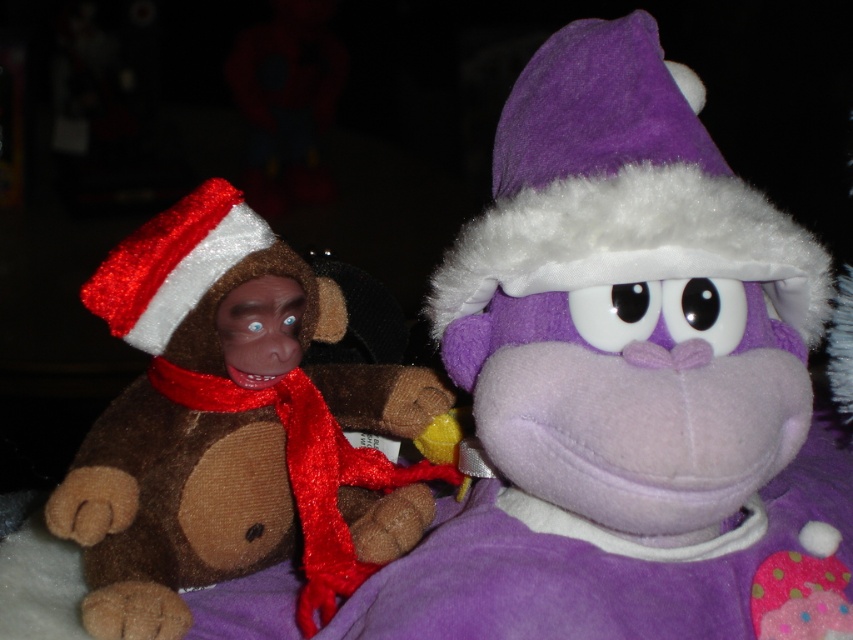
Is point (660, 426) farther from camera compared to point (334, 449)?

No, it is in front of (334, 449).

Does purple plush monkey at center have a lesser width compared to red satin scarf at left?

No, purple plush monkey at center is not thinner than red satin scarf at left.

Does point (759, 582) come in front of point (161, 384)?

That is True.

Where is `purple plush monkey at center`? The height and width of the screenshot is (640, 853). purple plush monkey at center is located at coordinates (625, 380).

Is purple felt santa hat at upper center positioned at the back of red satin scarf at left?

That is False.

Is purple felt santa hat at upper center shorter than red satin scarf at left?

In fact, purple felt santa hat at upper center may be taller than red satin scarf at left.

Does point (635, 268) come in front of point (149, 374)?

Yes, it is.

The image size is (853, 640). In order to click on purple felt santa hat at upper center in this screenshot , I will do `click(619, 188)`.

Between brown plush monkey at left and purple felt santa hat at upper center, which one has more height?

Standing taller between the two is brown plush monkey at left.

Which is behind, point (230, 486) or point (737, 259)?

The point (230, 486) is more distant.

Where is `brown plush monkey at left`? The image size is (853, 640). brown plush monkey at left is located at coordinates (234, 428).